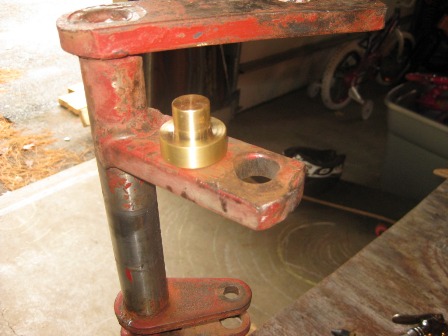
At what (x,y) coordinates should I click in order to perform the action: click on cement floor. Please return your answer as a coordinate pair (x, y). Image resolution: width=448 pixels, height=336 pixels. Looking at the image, I should click on (48, 257).